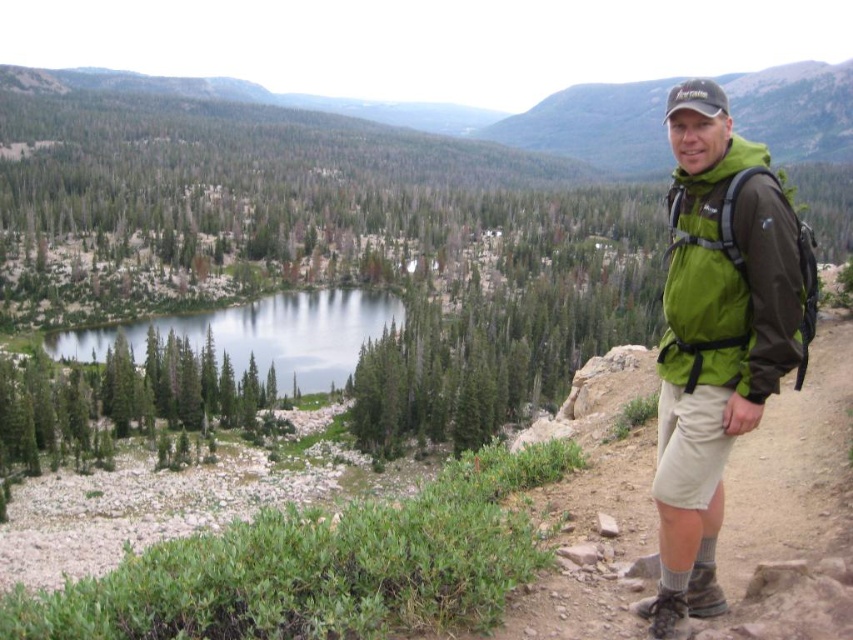
You are a photographer trying to capture the green fabric jacket at right and the clear glass water at left in the same frame. Based on their positions, which object should you adjust your camera to focus on first if you want to include both in your shot?

The green fabric jacket at right is positioned on the right side of clear glass water at left, so you should focus on the clear glass water at left first to ensure both objects are in the frame.

You are a photographer trying to capture the man in the scene. You notice the khaki shorts at right and the green fabric backpack at right. Which object should you focus on first if you want to ensure both are in the frame?

You should focus on the green fabric backpack at right first because it is above the khaki shorts at right, making it easier to frame both objects in the photo.